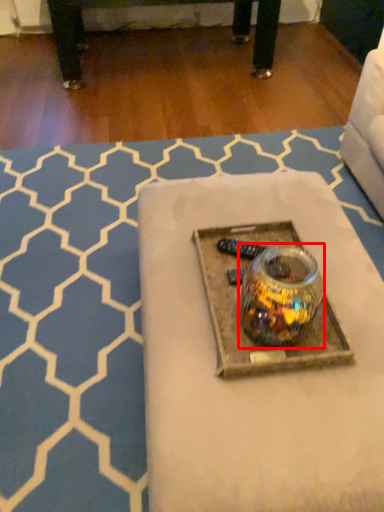
Question: Considering the relative positions of glass jar (annotated by the red box) and table in the image provided, where is glass jar (annotated by the red box) located with respect to the staircase?

Choices:
 (A) left
 (B) right

Answer: (B)